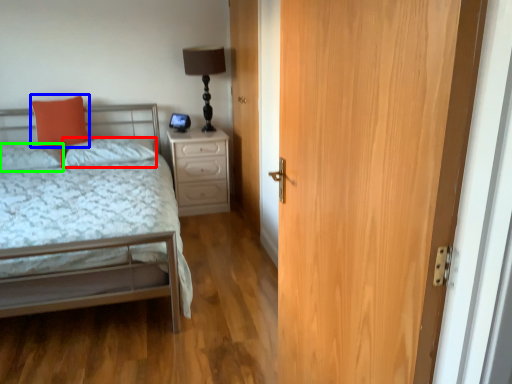
Question: Estimate the real-world distances between objects in this image. Which object is farther from pillow (highlighted by a red box), pillow (highlighted by a blue box) or pillow (highlighted by a green box)?

Choices:
 (A) pillow
 (B) pillow

Answer: (B)